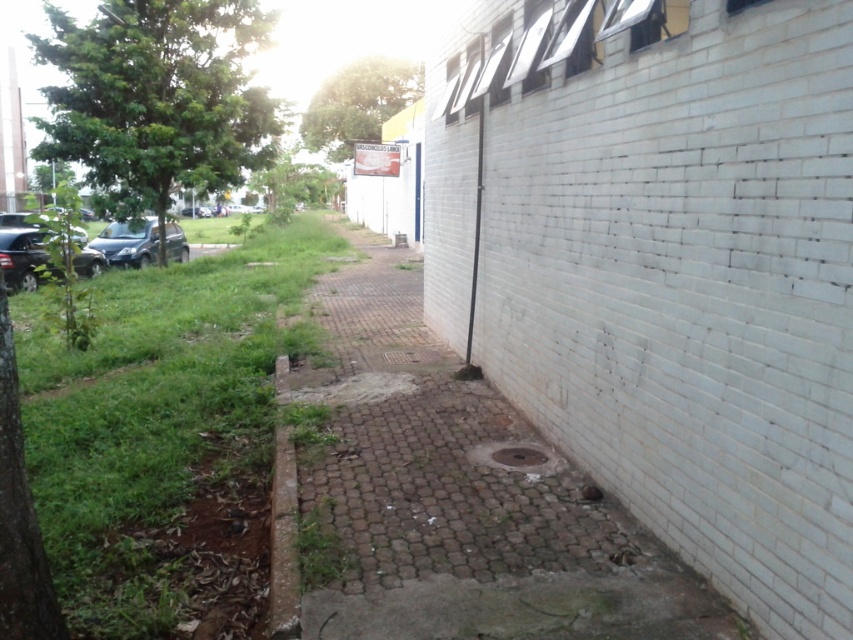
Question: Which point appears farthest from the camera in this image?

Choices:
 (A) click(x=129, y=230)
 (B) click(x=512, y=458)

Answer: (A)

Question: Where is white brick wall at center located in relation to brown concrete drain at center in the image?

Choices:
 (A) above
 (B) below

Answer: (A)

Question: Which of the following is the closest to the observer?

Choices:
 (A) (x=177, y=252)
 (B) (x=512, y=464)

Answer: (B)

Question: Based on their relative distances, which object is nearer to the green grass at left?

Choices:
 (A) metallic gray manhole cover at center
 (B) shiny black car at left

Answer: (A)

Question: Is metallic gray manhole cover at center above brown concrete drain at center?

Choices:
 (A) no
 (B) yes

Answer: (B)

Question: Where is metallic gray manhole cover at center located in relation to brown concrete drain at center in the image?

Choices:
 (A) below
 (B) above

Answer: (B)